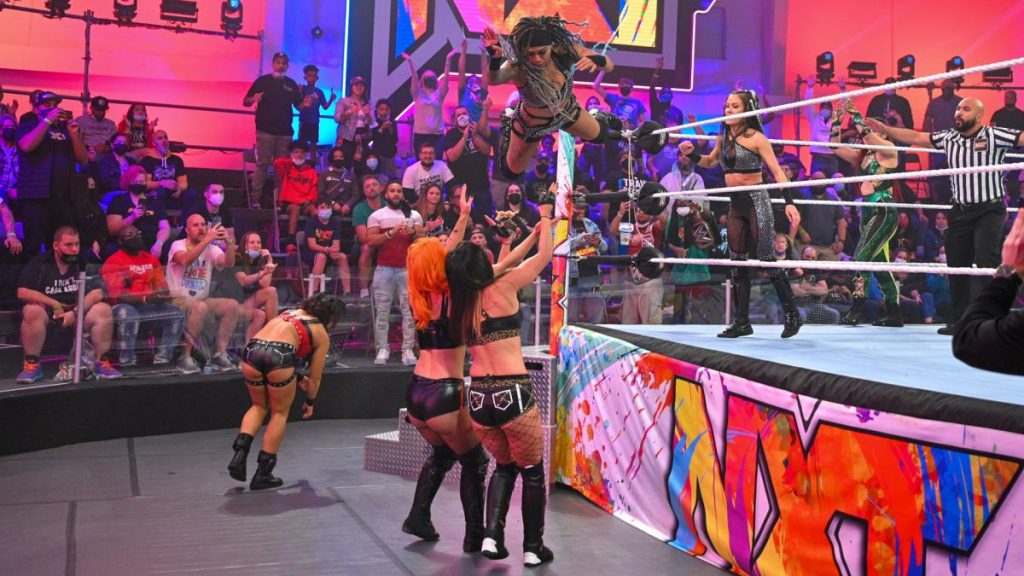
This screenshot has width=1024, height=576. I want to click on pink walls, so click(x=868, y=22), click(x=190, y=65).